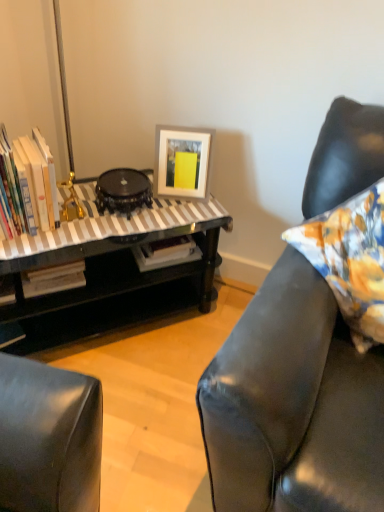
Locate an element on the screen. vacant space situated above black glossy round table at center (from a real-world perspective) is located at coordinates [124, 178].